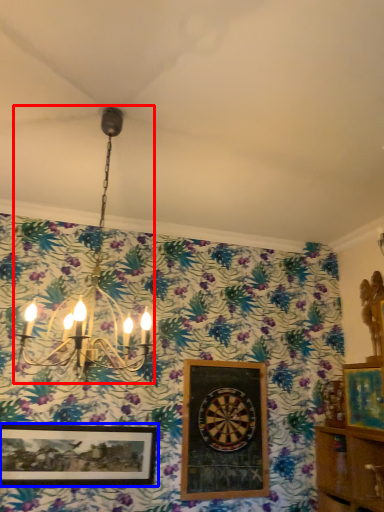
Question: Which point is closer to the camera, lamp (highlighted by a red box) or picture frame (highlighted by a blue box)?

Choices:
 (A) lamp
 (B) picture frame

Answer: (A)